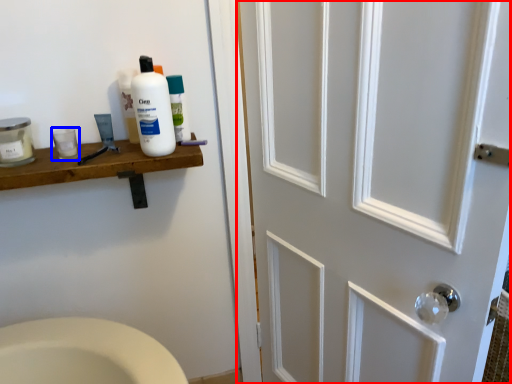
Question: Which point is closer to the camera, door (highlighted by a red box) or mouthwash (highlighted by a blue box)?

Choices:
 (A) door
 (B) mouthwash

Answer: (A)